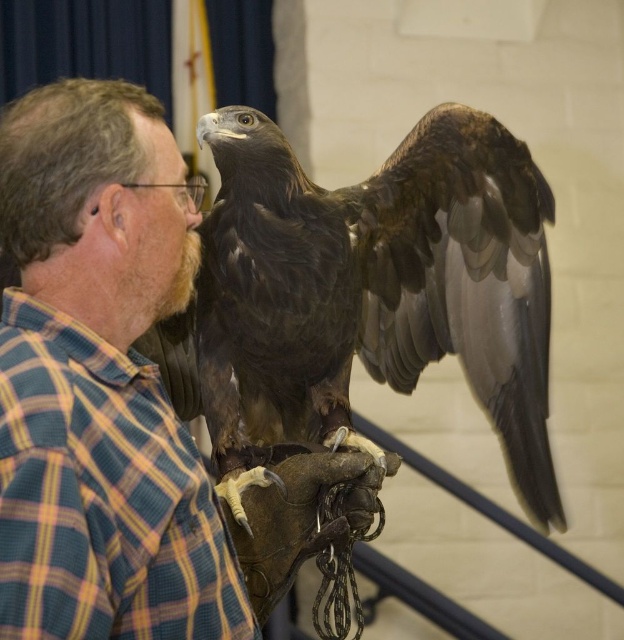
Consider the image. You are a photographer trying to capture the golden eagle in the image. You notice two points marked on your camera screen at coordinates point (x=240, y=266) and point (x=217, y=502). According to the scene, which point is closer to the camera?

Point (x=217, y=502) is closer to the camera because the point (x=240, y=266) is behind it.

You are a photographer trying to capture the brown feathered falcon at center in the center of your photo. According to the coordinates provided, is the falcon already centered in the image?

The brown feathered falcon at center is positioned at coordinates point (373, 288), which is slightly off the exact center of the image. To center it, you would need to adjust the camera slightly to the left and down.

You are standing at point (227,426) in the scene. The man and the golden eagle are 4.34 meters away from you. Can you safely approach them without getting too close? Please explain.

The man and the golden eagle are 4.34 meters away from your current position at point (227,426). Approaching them while maintaining a safe distance of at least 2 meters is advisable to avoid disturbing them. Since the distance is already 4.34 meters, you can move closer but ensure you stay at least 2 meters away for safety.